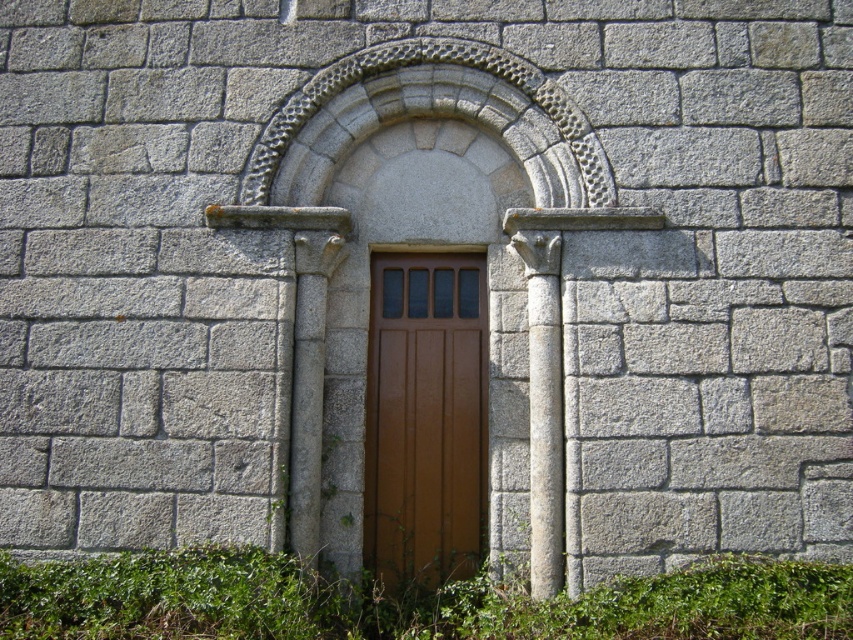
Question: Which point is farther to the camera?

Choices:
 (A) (370, 380)
 (B) (306, 582)

Answer: (A)

Question: Does green leafy weed at lower center have a smaller size compared to brown wooden door at center?

Choices:
 (A) no
 (B) yes

Answer: (A)

Question: Among these points, which one is farthest from the camera?

Choices:
 (A) (444, 285)
 (B) (67, 579)

Answer: (A)

Question: Observing the image, what is the correct spatial positioning of green leafy weed at lower center in reference to brown wooden door at center?

Choices:
 (A) right
 (B) left

Answer: (B)

Question: Which of the following is the closest to the observer?

Choices:
 (A) (582, 636)
 (B) (445, 577)
 (C) (553, 548)

Answer: (A)

Question: Can you confirm if green leafy weed at lower center is positioned below brown wooden door at center?

Choices:
 (A) yes
 (B) no

Answer: (A)